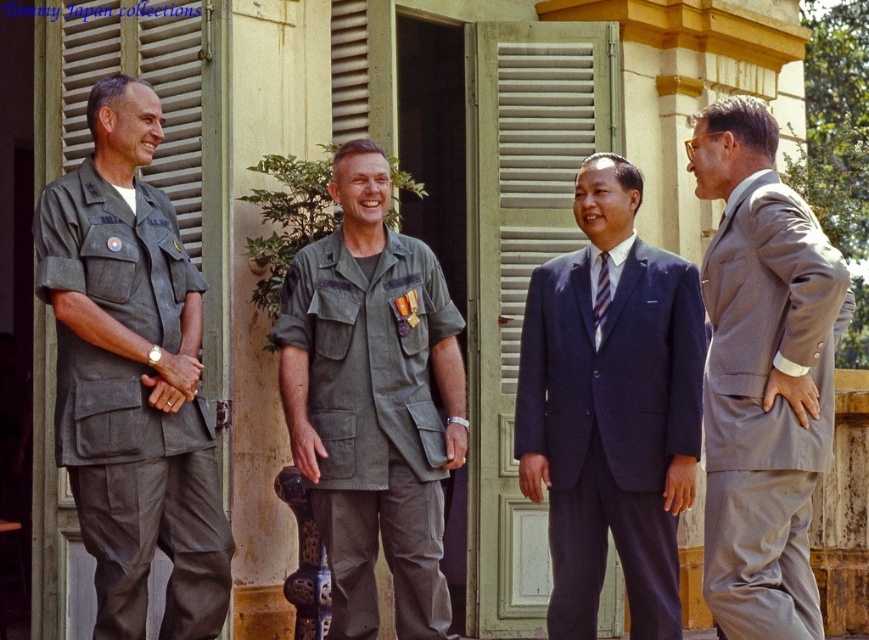
Identify the location of matte green uniform at center. (372, 401).

Does point (381, 269) come behind point (746, 234)?

That is True.

Locate an element on the screen. matte green uniform at center is located at coordinates (372, 401).

Who is more distant from viewer, (359, 211) or (602, 257)?

The point (602, 257) is more distant.

Who is more forward, (425, 474) or (600, 316)?

Point (425, 474)

Is point (445, 449) positioned behind point (604, 300)?

No, it is in front of (604, 300).

Locate an element on the screen. The width and height of the screenshot is (869, 640). matte green uniform at center is located at coordinates (372, 401).

The height and width of the screenshot is (640, 869). Describe the element at coordinates (131, 376) in the screenshot. I see `matte green uniform at left` at that location.

Is point (151, 269) positioned in front of point (596, 310)?

That is True.

Find the location of a particular element. matte green uniform at left is located at coordinates (131, 376).